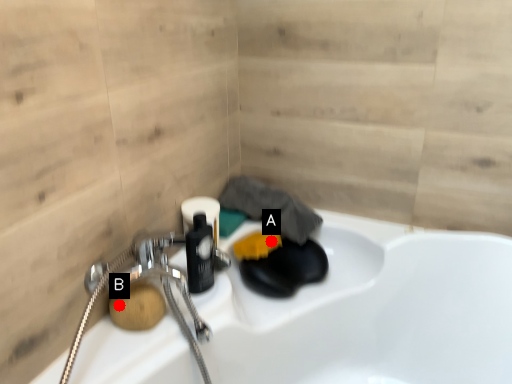
Question: Two points are circled on the image, labeled by A and B beside each circle. Among these points, which one is nearest to the camera?

Choices:
 (A) A is closer
 (B) B is closer

Answer: (B)